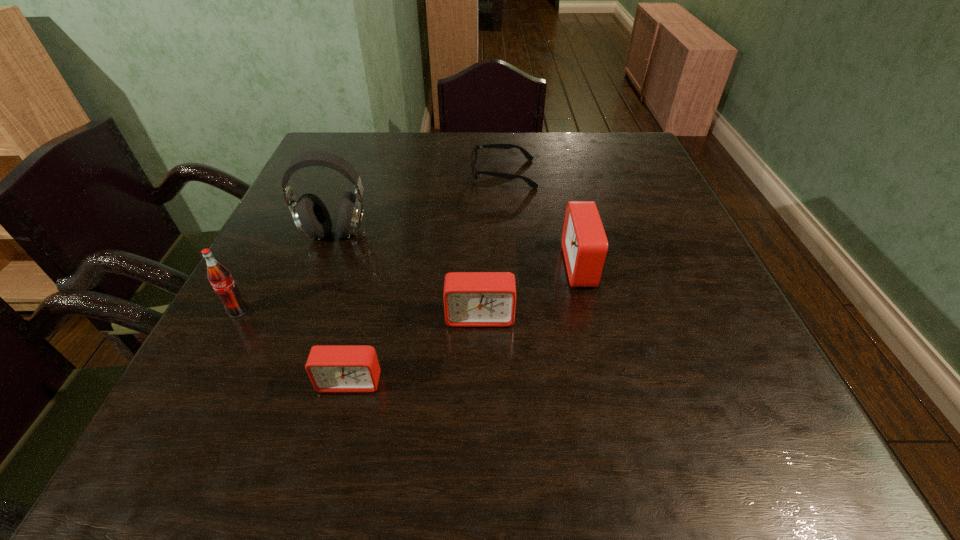
The height and width of the screenshot is (540, 960). In order to click on vacant space at the near right corner in this screenshot , I will do `click(701, 373)`.

Locate an element on the screen. Image resolution: width=960 pixels, height=540 pixels. vacant area that lies between the fourth tallest object and the tallest object is located at coordinates (408, 275).

Locate an element on the screen. free space between the headset and the shortest alarm clock is located at coordinates (343, 308).

The height and width of the screenshot is (540, 960). I want to click on free space between the nearest object and the shortest object, so click(x=427, y=278).

Locate an element on the screen. Image resolution: width=960 pixels, height=540 pixels. free space between the tallest alarm clock and the second alarm clock from right to left is located at coordinates (531, 291).

Where is `free space between the rightmost object and the second shortest alarm clock`? free space between the rightmost object and the second shortest alarm clock is located at coordinates (531, 291).

Locate an element on the screen. This screenshot has height=540, width=960. free space between the tallest object and the tallest alarm clock is located at coordinates (459, 249).

Locate an element on the screen. Image resolution: width=960 pixels, height=540 pixels. free space between the second farthest alarm clock and the leftmost object is located at coordinates (359, 314).

In order to click on free space between the headset and the fourth tallest object in this screenshot , I will do `click(408, 275)`.

At what (x,y) coordinates should I click in order to perform the action: click on free spot between the fifth shortest object and the farthest alarm clock. Please return your answer as a coordinate pair (x, y). Looking at the image, I should click on (410, 288).